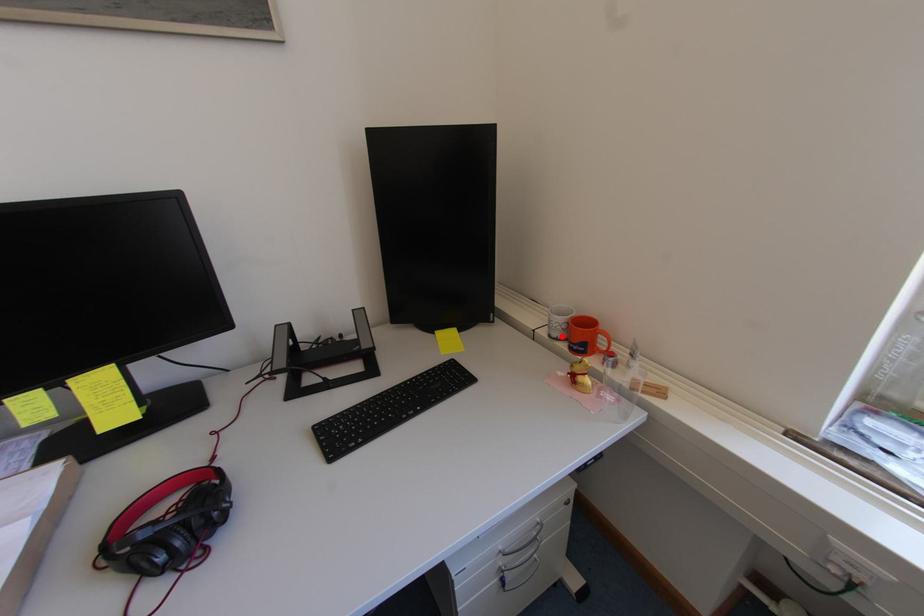
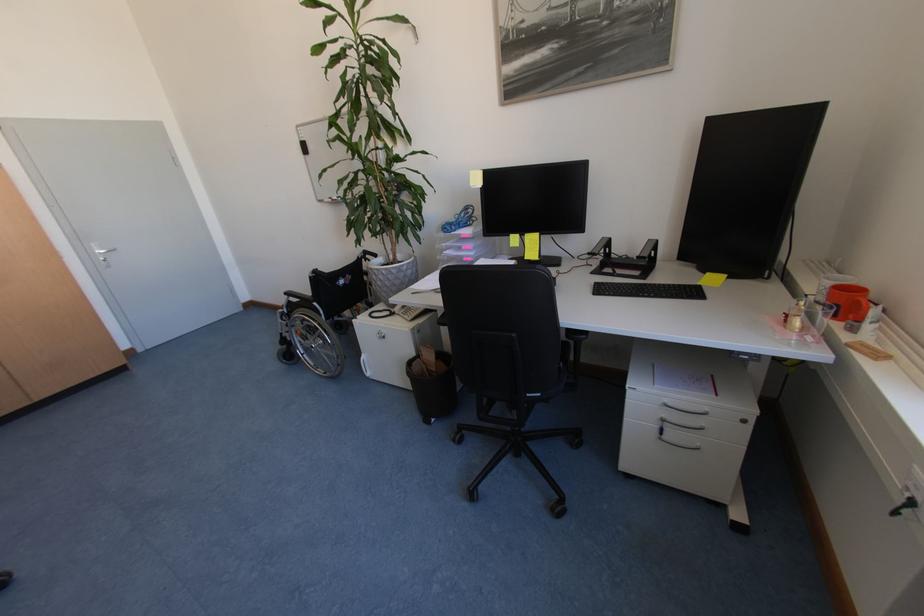
Question: I am providing you with two images of the same scene from different viewpoints. A red point is marked on the first image. Is the red point's position out of view in image 2?

Choices:
 (A) Yes
 (B) No

Answer: (B)